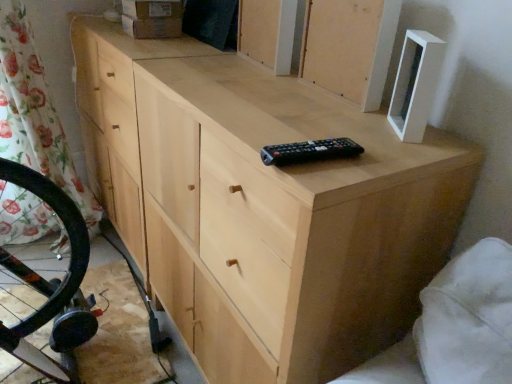
What do you see at coordinates (309, 151) in the screenshot?
I see `black plastic remote control at center` at bounding box center [309, 151].

You are a GUI agent. You are given a task and a screenshot of the screen. Output one action in this format:
    pyautogui.click(x=<x>, y=<y>)
    Task: Click on the black plastic remote control at center
    This screenshot has width=512, height=384.
    Given the screenshot: What is the action you would take?
    pyautogui.click(x=309, y=151)

Where is `black plastic remote control at center`? black plastic remote control at center is located at coordinates (309, 151).